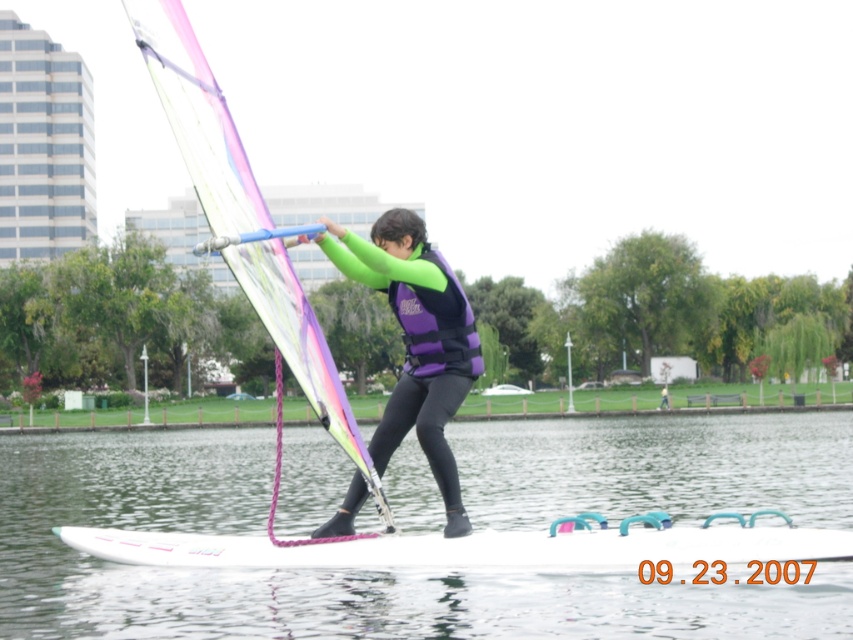
Question: Estimate the real-world distances between objects in this image. Which object is closer to the purple matte life jacket at center?

Choices:
 (A) white smooth water at center
 (B) purple neoprene wetsuit at center
 (C) purple matte life vest at center
 (D) white glossy surfboard at center

Answer: (C)

Question: Which object is farther from the camera taking this photo?

Choices:
 (A) purple matte life jacket at center
 (B) purple matte life vest at center
 (C) translucent plastic sail at center

Answer: (A)

Question: Is white smooth water at center to the right of white glossy surfboard at center from the viewer's perspective?

Choices:
 (A) no
 (B) yes

Answer: (A)

Question: From the image, what is the correct spatial relationship of purple matte life vest at center in relation to purple neoprene wetsuit at center?

Choices:
 (A) right
 (B) left

Answer: (B)

Question: Which point appears farthest from the camera in this image?

Choices:
 (A) (442, 298)
 (B) (830, 566)
 (C) (662, 404)

Answer: (C)

Question: Does purple matte life vest at center come in front of purple matte life jacket at center?

Choices:
 (A) no
 (B) yes

Answer: (B)